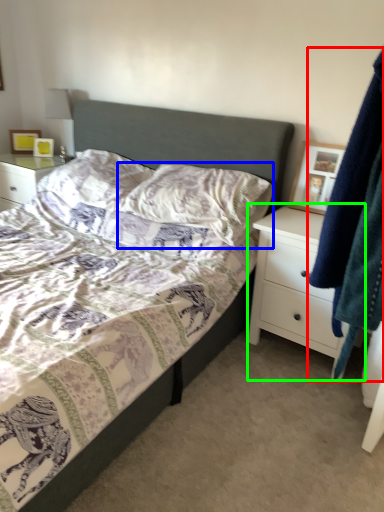
Question: Which object is positioned closest to clothing (highlighted by a red box)? Select from pillow (highlighted by a blue box) and chest of drawers (highlighted by a green box).

Choices:
 (A) pillow
 (B) chest of drawers

Answer: (B)